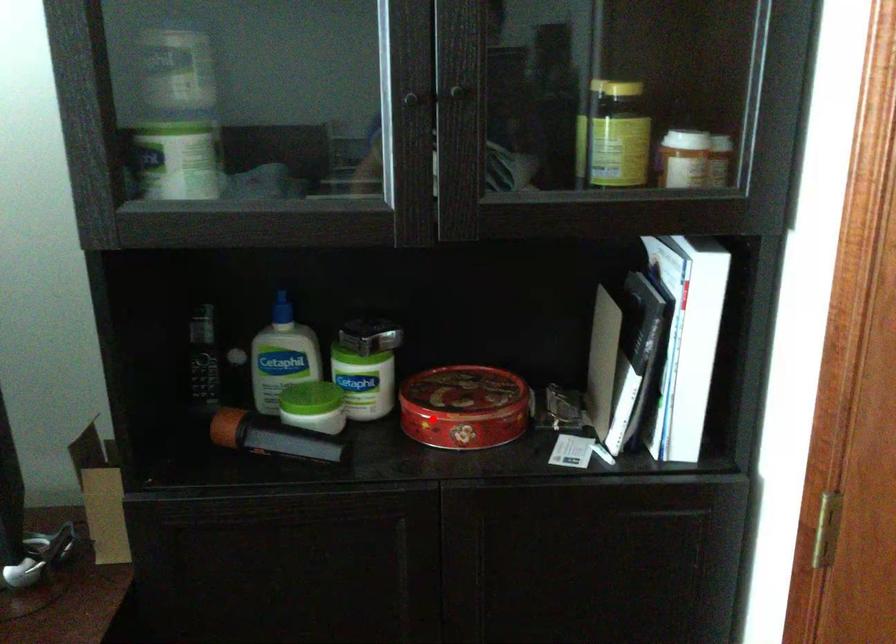
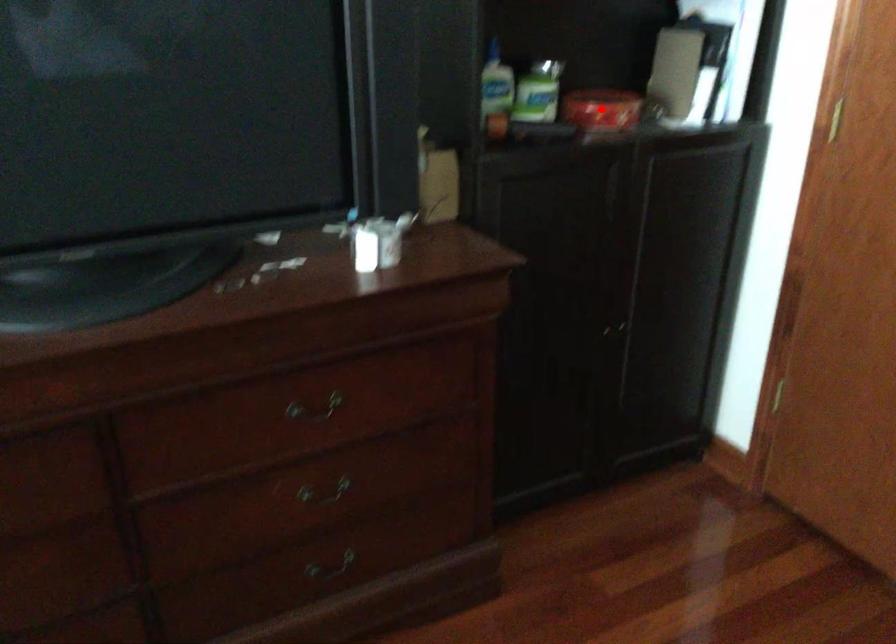
I am providing you with two images of the same scene from different viewpoints. A red point is marked on the first image and another point is marked on the second image. Do the highlighted points in image1 and image2 indicate the same real-world spot?

Yes